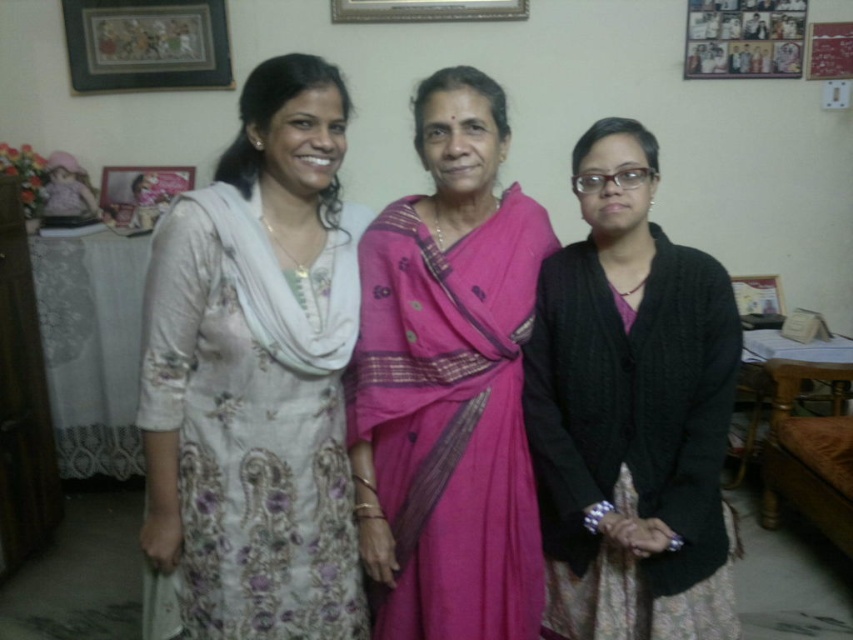
Who is taller, pink silk saree at center or matte wooden picture frame at upper left?

Standing taller between the two is pink silk saree at center.

Does pink silk saree at center have a greater width compared to matte wooden picture frame at upper left?

No.

Is point (436, 586) farther from viewer compared to point (196, 12)?

No, (436, 586) is in front of (196, 12).

Locate an element on the screen. The height and width of the screenshot is (640, 853). pink silk saree at center is located at coordinates (448, 384).

Does black knitted cardigan at center have a lesser height compared to wooden picture frame at upper right?

Incorrect, black knitted cardigan at center's height does not fall short of wooden picture frame at upper right's.

Does point (717, 288) come closer to viewer compared to point (770, 296)?

That is True.

Where is `black knitted cardigan at center`? The width and height of the screenshot is (853, 640). black knitted cardigan at center is located at coordinates (630, 412).

Find the location of a particular element. black knitted cardigan at center is located at coordinates (630, 412).

Is metallic silver picture frame at upper center further to the viewer compared to wooden picture frame at upper right?

That is False.

Does point (473, 10) come in front of point (751, 317)?

That is True.

Does point (442, 13) come farther from viewer compared to point (758, 314)?

No, it is in front of (758, 314).

You are a GUI agent. You are given a task and a screenshot of the screen. Output one action in this format:
    pyautogui.click(x=<x>, y=<y>)
    Task: Click on the metallic silver picture frame at upper center
    
    Given the screenshot: What is the action you would take?
    click(x=426, y=10)